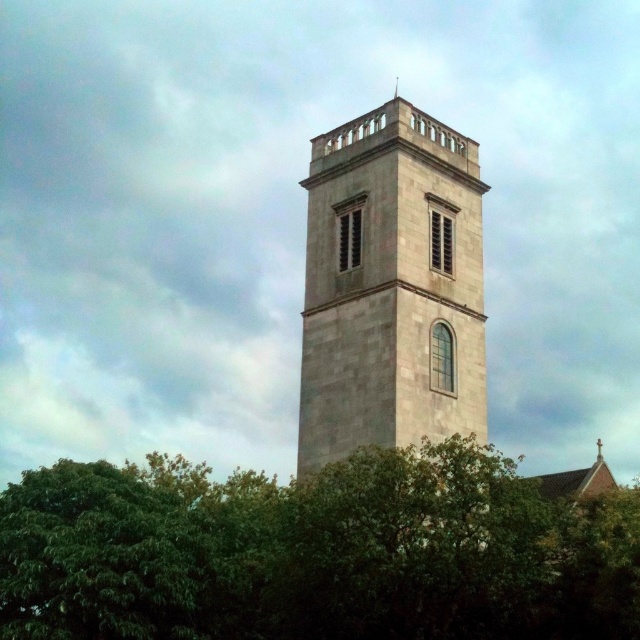
Question: Among these objects, which one is farthest from the camera?

Choices:
 (A) light gray stone tower at center
 (B) green leafy tree at center

Answer: (A)

Question: Which point is farther to the camera?

Choices:
 (A) (477, 532)
 (B) (310, 253)

Answer: (B)

Question: Can you confirm if green leafy tree at center is bigger than light gray stone tower at center?

Choices:
 (A) no
 (B) yes

Answer: (B)

Question: Which point is farther to the camera?

Choices:
 (A) green leafy tree at center
 (B) light gray stone tower at center

Answer: (B)

Question: From the image, what is the correct spatial relationship of green leafy tree at center in relation to light gray stone tower at center?

Choices:
 (A) left
 (B) right

Answer: (A)

Question: From the image, what is the correct spatial relationship of green leafy tree at center in relation to light gray stone tower at center?

Choices:
 (A) above
 (B) below

Answer: (B)